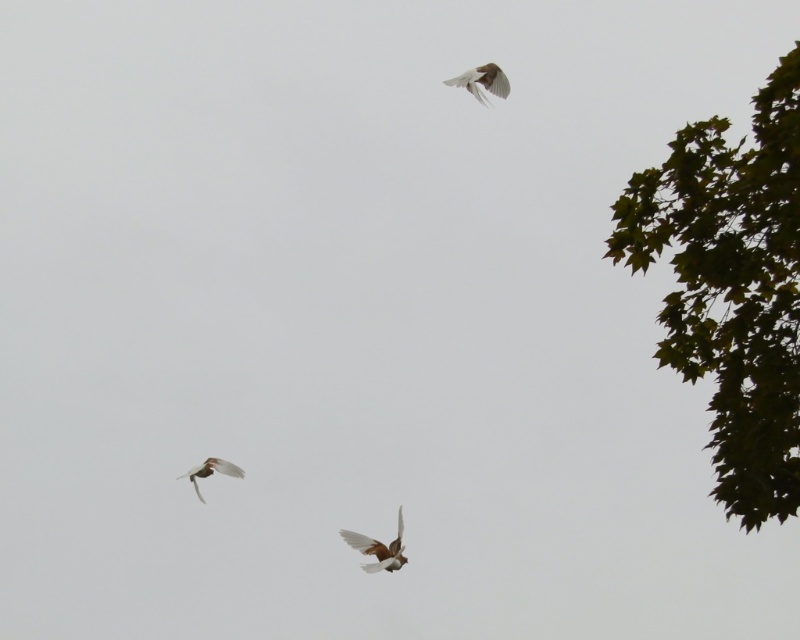
Is green leafy tree at upper right above brown feathered bird at center?

Correct, green leafy tree at upper right is located above brown feathered bird at center.

Can you confirm if green leafy tree at upper right is positioned to the left of brown feathered bird at center?

No, green leafy tree at upper right is not to the left of brown feathered bird at center.

Between point (709, 275) and point (392, 566), which one is positioned in front?

Positioned in front is point (709, 275).

I want to click on green leafy tree at upper right, so click(x=732, y=288).

Who is positioned more to the left, brown feathered bird at center or white feathered bird at upper center?

Positioned to the left is brown feathered bird at center.

Can you confirm if brown feathered bird at center is taller than white feathered bird at upper center?

Yes.

Does point (352, 531) come behind point (458, 80)?

Yes, it is.

Locate an element on the screen. The width and height of the screenshot is (800, 640). brown feathered bird at center is located at coordinates [378, 548].

Who is positioned more to the left, green leafy tree at upper right or white feathered bird at upper center?

white feathered bird at upper center

Between green leafy tree at upper right and white feathered bird at upper center, which one appears on the right side from the viewer's perspective?

From the viewer's perspective, green leafy tree at upper right appears more on the right side.

Between point (758, 195) and point (492, 76), which one is positioned in front?

Point (758, 195)

Where is `green leafy tree at upper right`? The height and width of the screenshot is (640, 800). green leafy tree at upper right is located at coordinates (732, 288).